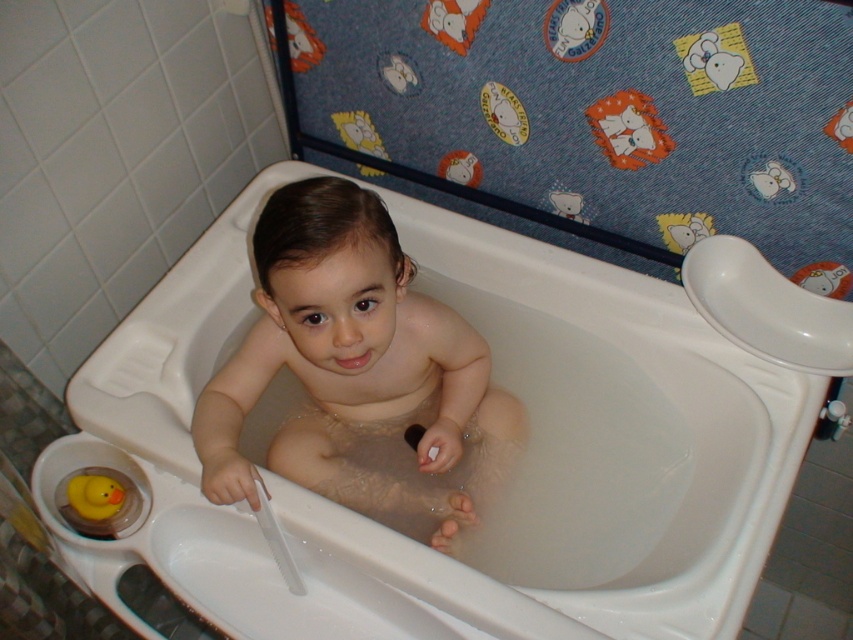
You are a parent checking the bath water temperature. You notice the point at coordinates (357, 372) on the baby. Based on the scene description, where is this point located?

The point at coordinates (357, 372) is located on the smooth skin of the baby at the center of the image.

From the picture: You are a parent checking the safety of the bathtub setup for your child. Based on the image, is the smooth skin baby at center positioned safely within the white plastic bathtub at center?

The white plastic bathtub at center is located below smooth skin baby at center, which means the baby is sitting in the bathtub properly. This positioning is safe as the baby is securely seated inside the bathtub.

You are a parent trying to locate two points in the bathroom scene. The first point is at coordinates point (x=631, y=506) and the second is at point (x=113, y=481). Which point is closer to you as you look at the scene?

Point (x=631, y=506) is closer to you because it is further to the viewer than point (x=113, y=481).